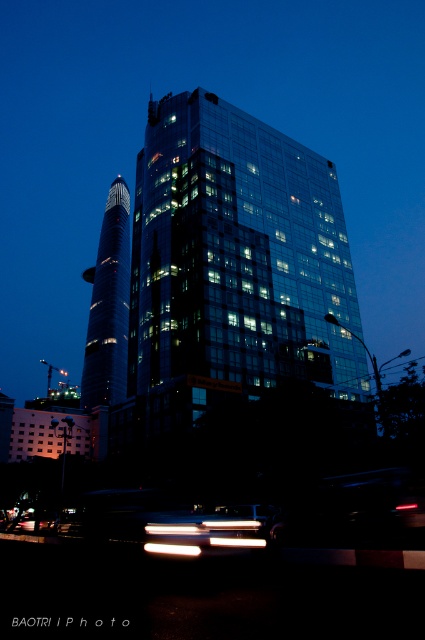
Question: Estimate the real-world distances between objects in this image. Which object is closer to the metallic silver car at lower center?

Choices:
 (A) white glossy light at center
 (B) transparent glass building at center
 (C) black glass tower at left

Answer: (A)

Question: Does black glass tower at left appear on the right side of white glossy light at center?

Choices:
 (A) yes
 (B) no

Answer: (B)

Question: Which object appears farthest from the camera in this image?

Choices:
 (A) white glossy light at center
 (B) transparent glass building at center

Answer: (B)

Question: Estimate the real-world distances between objects in this image. Which object is closer to the metallic silver car at lower center?

Choices:
 (A) white glossy light at center
 (B) black glass tower at left

Answer: (A)

Question: Where is metallic silver car at lower center located in relation to white glossy light at center in the image?

Choices:
 (A) below
 (B) above

Answer: (A)

Question: Is transparent glass building at center below white glossy light at center?

Choices:
 (A) no
 (B) yes

Answer: (A)